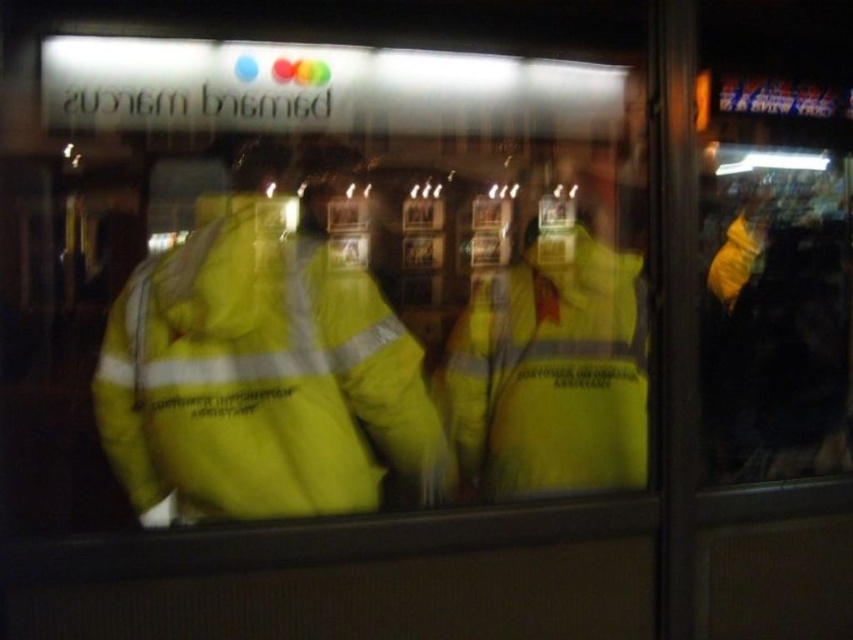
Is high-visibility yellow jacket at center below high-visibility yellow safety vest at center?

Indeed, high-visibility yellow jacket at center is positioned under high-visibility yellow safety vest at center.

Is point (393, 397) positioned after point (538, 397)?

No, (393, 397) is in front of (538, 397).

This screenshot has height=640, width=853. What are the coordinates of `high-visibility yellow jacket at center` in the screenshot? It's located at (262, 384).